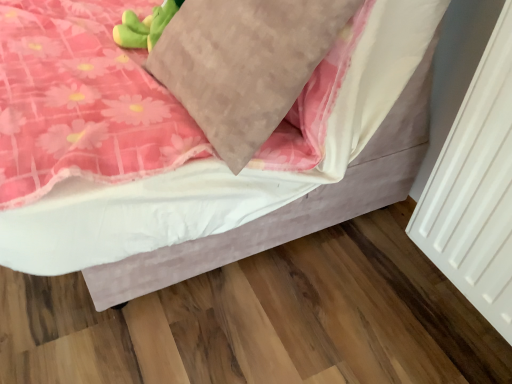
Measure the distance between point (276,124) and camera.

25.00 inches.

What do you see at coordinates (244, 64) in the screenshot? This screenshot has height=384, width=512. I see `textured beige pillow at center` at bounding box center [244, 64].

Image resolution: width=512 pixels, height=384 pixels. In order to click on textured beige pillow at center in this screenshot , I will do `click(244, 64)`.

The width and height of the screenshot is (512, 384). What do you see at coordinates (242, 182) in the screenshot?
I see `velvet pink bed at center` at bounding box center [242, 182].

This screenshot has height=384, width=512. Identify the location of velvet pink bed at center. (242, 182).

The width and height of the screenshot is (512, 384). What are the coordinates of `textured beige pillow at center` in the screenshot? It's located at (244, 64).

Is textured beige pillow at center at the right side of velvet pink bed at center?

Yes.

Relative to velvet pink bed at center, is textured beige pillow at center in front or behind?

Clearly, textured beige pillow at center is behind velvet pink bed at center.

Which is less distant, (161, 40) or (382, 13)?

Point (161, 40) appears to be farther away from the viewer than point (382, 13).

From the image's perspective, is textured beige pillow at center on velvet pink bed at center?

No, from the image's perspective, textured beige pillow at center is not over velvet pink bed at center.

From a real-world perspective, which object rests below the other?

In real-world perspective, velvet pink bed at center is lower.

Which object is thinner, textured beige pillow at center or velvet pink bed at center?

With smaller width is textured beige pillow at center.

Does textured beige pillow at center have a lesser height compared to velvet pink bed at center?

Correct, textured beige pillow at center is not as tall as velvet pink bed at center.

Looking at the image, does textured beige pillow at center seem bigger or smaller compared to velvet pink bed at center?

In the image, textured beige pillow at center appears to be smaller than velvet pink bed at center.

Would you say textured beige pillow at center is outside velvet pink bed at center?

Actually, textured beige pillow at center is within velvet pink bed at center.

Is textured beige pillow at center directly adjacent to velvet pink bed at center?

textured beige pillow at center is not next to velvet pink bed at center, and they're not touching.

Is textured beige pillow at center positioned with its back to velvet pink bed at center?

Yes, textured beige pillow at center is positioned with its back facing velvet pink bed at center.

The width and height of the screenshot is (512, 384). Identify the location of bed on the left of the textured beige pillow at center. (242, 182).

Considering the relative positions of velvet pink bed at center and textured beige pillow at center in the image provided, is velvet pink bed at center to the left of textured beige pillow at center from the viewer's perspective?

Indeed, velvet pink bed at center is positioned on the left side of textured beige pillow at center.

Between velvet pink bed at center and textured beige pillow at center, which one is positioned behind?

textured beige pillow at center.

Which is behind, point (40, 255) or point (184, 5)?

The point (184, 5) is behind.

From the image's perspective, would you say velvet pink bed at center is positioned over textured beige pillow at center?

Indeed, from the image's perspective, velvet pink bed at center is shown above textured beige pillow at center.

From a real-world perspective, who is located lower, velvet pink bed at center or textured beige pillow at center?

velvet pink bed at center, from a real-world perspective.

Is velvet pink bed at center thinner than textured beige pillow at center?

No.

Does velvet pink bed at center have a lesser height compared to textured beige pillow at center?

In fact, velvet pink bed at center may be taller than textured beige pillow at center.

Consider the image. Between velvet pink bed at center and textured beige pillow at center, which one has smaller size?

textured beige pillow at center.

Is velvet pink bed at center located outside textured beige pillow at center?

Indeed, velvet pink bed at center is completely outside textured beige pillow at center.

Is velvet pink bed at center touching textured beige pillow at center?

No, velvet pink bed at center is not next to textured beige pillow at center.

Is velvet pink bed at center oriented away from textured beige pillow at center?

That's right, velvet pink bed at center is facing away from textured beige pillow at center.

How different are the orientations of velvet pink bed at center and textured beige pillow at center in degrees?

There is a 4.35-degree angle between the facing directions of velvet pink bed at center and textured beige pillow at center.

You are a GUI agent. You are given a task and a screenshot of the screen. Output one action in this format:
    pyautogui.click(x=<x>, y=<y>)
    Task: Click on the pillow on the right of velvet pink bed at center
    The image size is (512, 384).
    Given the screenshot: What is the action you would take?
    pyautogui.click(x=244, y=64)

This screenshot has height=384, width=512. I want to click on bed that is on the left side of textured beige pillow at center, so click(x=242, y=182).

Find the location of a particular element. Image resolution: width=512 pixels, height=384 pixels. pillow below the velvet pink bed at center (from the image's perspective) is located at coordinates (244, 64).